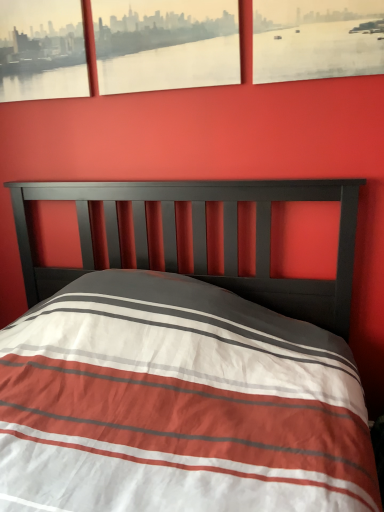
Question: Is matte black picture frame at upper left, the third picture frame viewed from the right, not within matte paper picture frame at upper center, the 2th picture frame viewed from the left?

Choices:
 (A) yes
 (B) no

Answer: (A)

Question: Considering the relative sizes of matte black picture frame at upper left, the third picture frame viewed from the right, and matte paper picture frame at upper center, the 2th picture frame viewed from the left, in the image provided, is matte black picture frame at upper left, the third picture frame viewed from the right, thinner than matte paper picture frame at upper center, the 2th picture frame viewed from the left,?

Choices:
 (A) yes
 (B) no

Answer: (A)

Question: From a real-world perspective, is matte black picture frame at upper left, acting as the first picture frame starting from the left, below matte paper picture frame at upper center, the second picture frame in the right-to-left sequence?

Choices:
 (A) no
 (B) yes

Answer: (A)

Question: Is matte black picture frame at upper left, acting as the first picture frame starting from the left, facing away from matte paper picture frame at upper center, the second picture frame in the right-to-left sequence?

Choices:
 (A) yes
 (B) no

Answer: (B)

Question: Could you tell me if matte black picture frame at upper left, acting as the first picture frame starting from the left, is facing matte paper picture frame at upper center, the second picture frame in the right-to-left sequence?

Choices:
 (A) yes
 (B) no

Answer: (B)

Question: Is the surface of matte black picture frame at upper left, acting as the first picture frame starting from the left, in direct contact with matte paper picture frame at upper center, the 2th picture frame viewed from the left?

Choices:
 (A) no
 (B) yes

Answer: (A)

Question: Could you tell me if matte paper picture frame at upper center, the 2th picture frame viewed from the left, is facing matte paper picture frame at upper right, which is the 1th picture frame from right to left?

Choices:
 (A) no
 (B) yes

Answer: (A)

Question: Is matte paper picture frame at upper center, the second picture frame in the right-to-left sequence, shorter than matte paper picture frame at upper right, the third picture frame when ordered from left to right?

Choices:
 (A) yes
 (B) no

Answer: (B)

Question: Is matte paper picture frame at upper center, the 2th picture frame viewed from the left, to the left of matte paper picture frame at upper right, the third picture frame when ordered from left to right, from the viewer's perspective?

Choices:
 (A) no
 (B) yes

Answer: (B)

Question: Is matte paper picture frame at upper center, the second picture frame in the right-to-left sequence, next to matte paper picture frame at upper right, which is the 1th picture frame from right to left, and touching it?

Choices:
 (A) no
 (B) yes

Answer: (A)

Question: From the image's perspective, would you say matte paper picture frame at upper center, the second picture frame in the right-to-left sequence, is positioned over matte paper picture frame at upper right, the third picture frame when ordered from left to right?

Choices:
 (A) yes
 (B) no

Answer: (A)

Question: Is matte paper picture frame at upper center, the 2th picture frame viewed from the left, positioned in front of matte paper picture frame at upper right, the third picture frame when ordered from left to right?

Choices:
 (A) no
 (B) yes

Answer: (A)

Question: From the image's perspective, is matte paper picture frame at upper right, which is the 1th picture frame from right to left, over matte paper picture frame at upper center, the 2th picture frame viewed from the left?

Choices:
 (A) no
 (B) yes

Answer: (A)